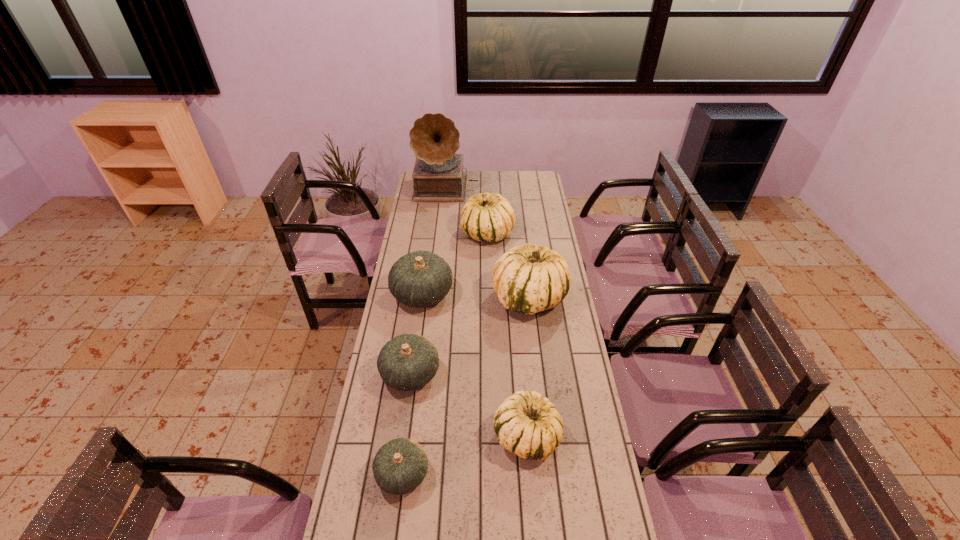
This screenshot has width=960, height=540. What are the coordinates of `object present at the far left corner` in the screenshot? It's located at (438, 177).

Where is `vacant area at the far edge`? This screenshot has width=960, height=540. vacant area at the far edge is located at coordinates (480, 180).

Where is `free location at the left edge of the desktop`? This screenshot has width=960, height=540. free location at the left edge of the desktop is located at coordinates (388, 330).

At what (x,y) coordinates should I click in order to perform the action: click on free space at the right edge. Please return your answer as a coordinate pair (x, y). The image size is (960, 540). Looking at the image, I should click on (615, 511).

The image size is (960, 540). In order to click on vacant space at the far right corner of the desktop in this screenshot , I will do `click(539, 174)`.

Identify the location of free spot between the record player and the second nearest white gourd. 488,244.

Image resolution: width=960 pixels, height=540 pixels. I want to click on free space between the farthest object and the biggest orange gourd, so click(x=434, y=241).

Identify the location of blank region between the biggest white gourd and the farthest orange gourd. This screenshot has height=540, width=960. (475, 296).

This screenshot has width=960, height=540. I want to click on vacant space that is in between the biggest orange gourd and the tallest object, so click(x=434, y=241).

Identify the location of vacant space that is in between the nearest white gourd and the smallest orange gourd. (465, 455).